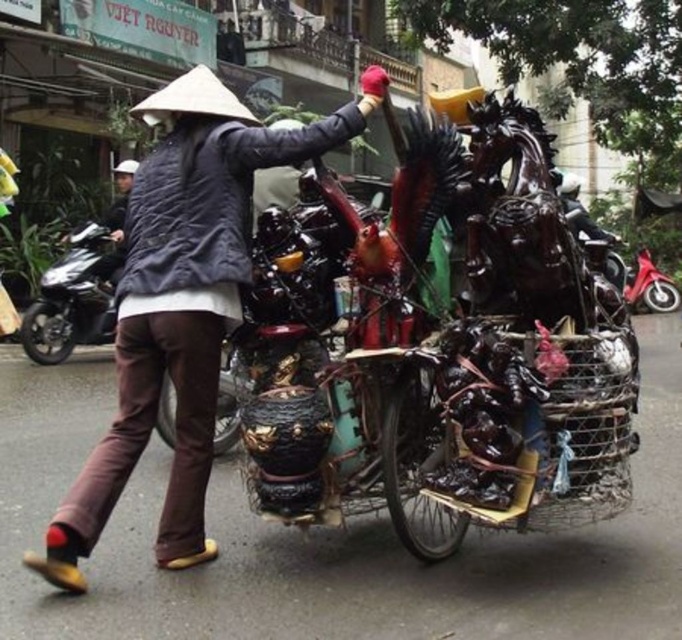
Question: Is shiny black motorcycle at left below metallic red scooter at right?

Choices:
 (A) yes
 (B) no

Answer: (A)

Question: Observing the image, what is the correct spatial positioning of matte black vase at center in reference to shiny black motorcycle at left?

Choices:
 (A) below
 (B) above

Answer: (A)

Question: Based on their relative distances, which object is nearer to the matte black vase at center?

Choices:
 (A) metallic red scooter at right
 (B) shiny black motorcycle at left

Answer: (B)

Question: Among these points, which one is nearest to the camera?

Choices:
 (A) (48, 346)
 (B) (627, 296)

Answer: (A)

Question: Which point is closer to the camera?

Choices:
 (A) (166, 355)
 (B) (74, 276)

Answer: (A)

Question: Does shiny black motorcycle at left appear over metallic red scooter at right?

Choices:
 (A) yes
 (B) no

Answer: (B)